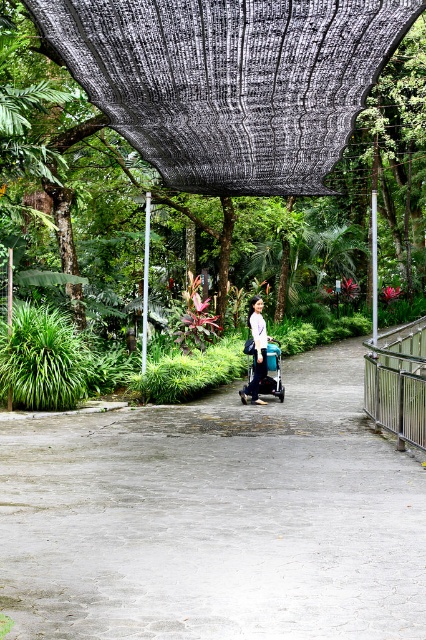
You are a parent pushing the blue fabric stroller at center along the gray concrete path at center. Can you easily maneuver the stroller over the path?

The gray concrete path at center has a lesser height compared to blue fabric stroller at center, so yes, the parent can easily maneuver the stroller over the path since the path is lower than the stroller.

You are standing at the entrance of the garden and see a white fabric bag at center. Where is the white fabric bag located relative to your position?

The white fabric bag at center is located at the coordinates 0.548 in the x direction and 0.603 in the y direction relative to the image frame.